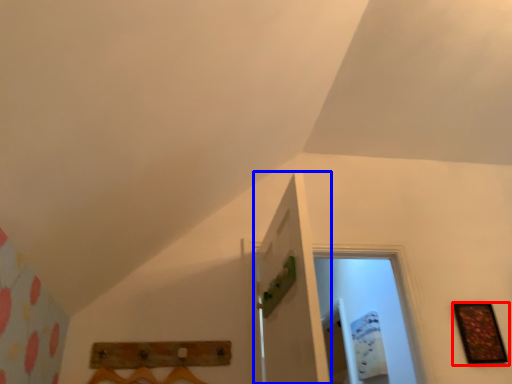
Question: Which object appears closest to the camera in this image, picture frame (highlighted by a red box) or door (highlighted by a blue box)?

Choices:
 (A) picture frame
 (B) door

Answer: (B)